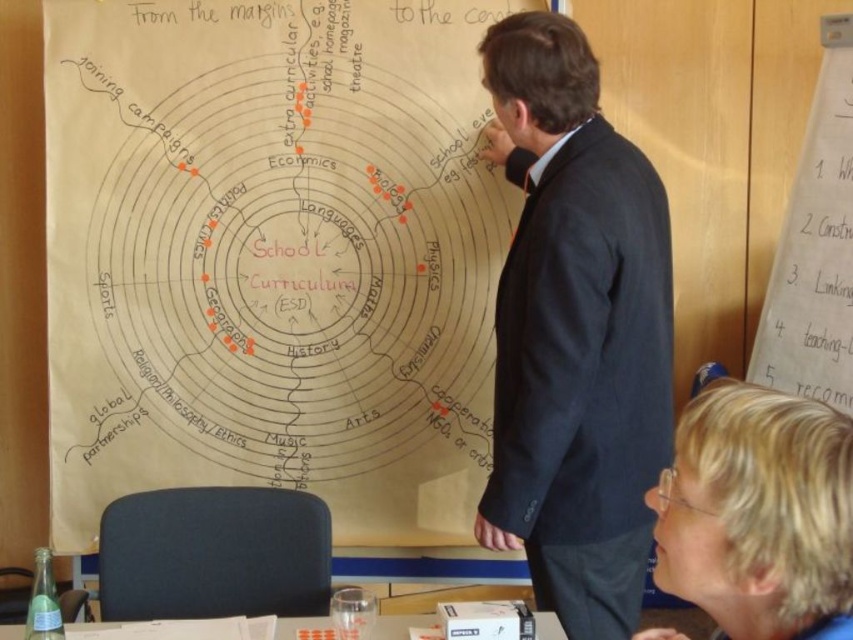
Based on the provided scene, where is the dark blue suit at center positioned in terms of coordinates?

The dark blue suit at center is located at point coordinates of 0.520 in the x axis and 0.675 in the y axis.

You are an attendee at the presentation and want to focus on the white paper at upper right and the white paper at lower center. Which one is closer to you?

The white paper at upper right is closer to you because it is further to the viewer than the white paper at lower center.